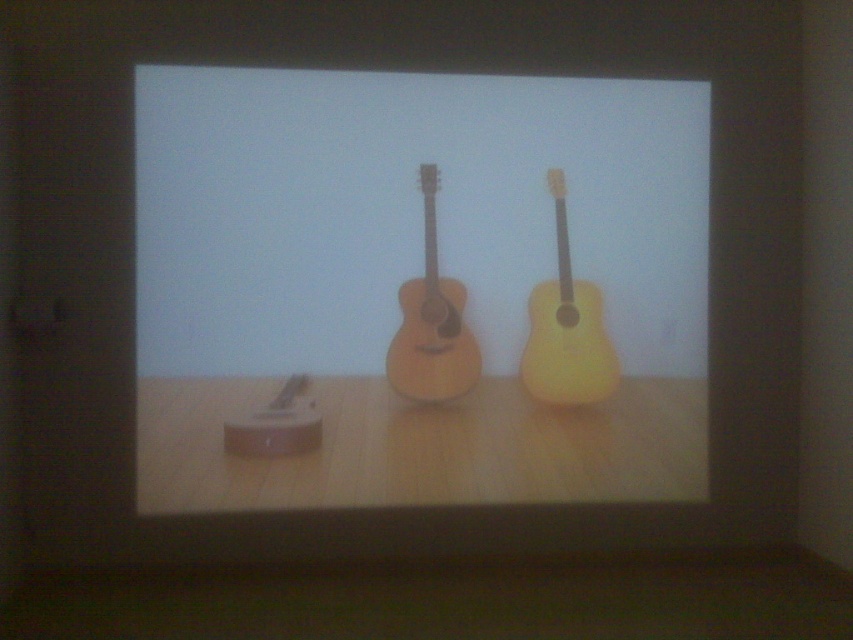
Question: Does yellow matte guitar at right appear on the right side of natural wood acoustic guitar at center?

Choices:
 (A) yes
 (B) no

Answer: (A)

Question: Does yellow matte guitar at right appear over natural wood acoustic guitar at center?

Choices:
 (A) no
 (B) yes

Answer: (A)

Question: Which object appears closest to the camera in this image?

Choices:
 (A) yellow matte guitar at right
 (B) natural wood acoustic guitar at center

Answer: (B)

Question: Is yellow matte guitar at right bigger than natural wood acoustic guitar at center?

Choices:
 (A) yes
 (B) no

Answer: (A)

Question: Which object is closer to the camera taking this photo?

Choices:
 (A) yellow matte guitar at right
 (B) natural wood acoustic guitar at center

Answer: (B)